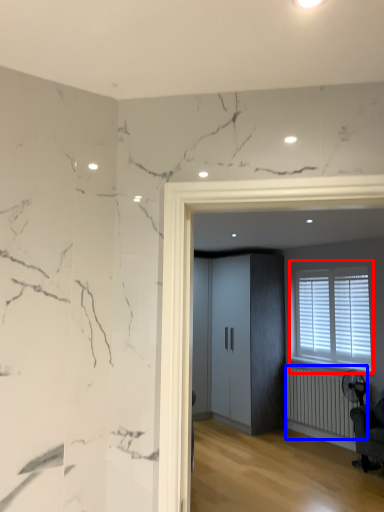
Question: Which point is closer to the camera, window (highlighted by a red box) or radiator (highlighted by a blue box)?

Choices:
 (A) window
 (B) radiator

Answer: (B)